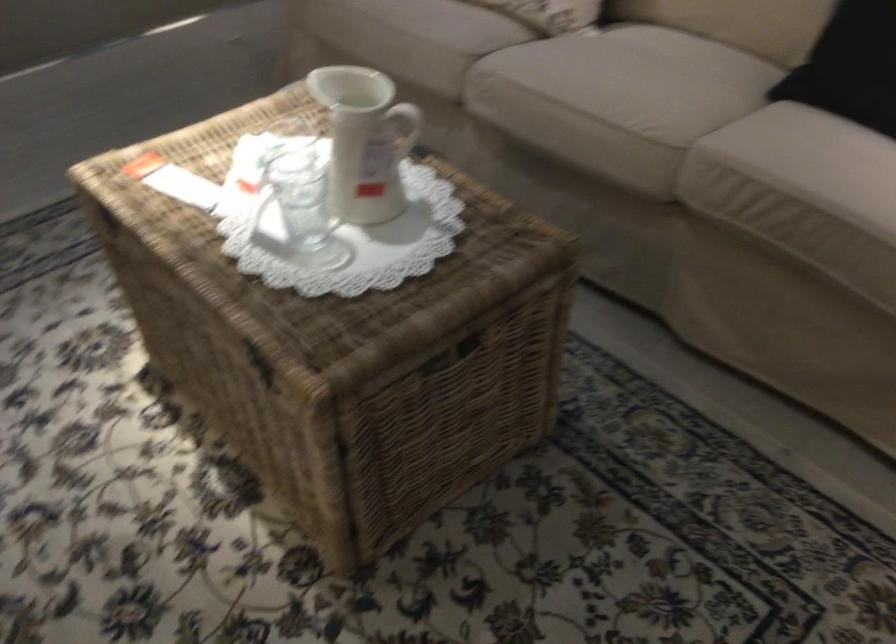
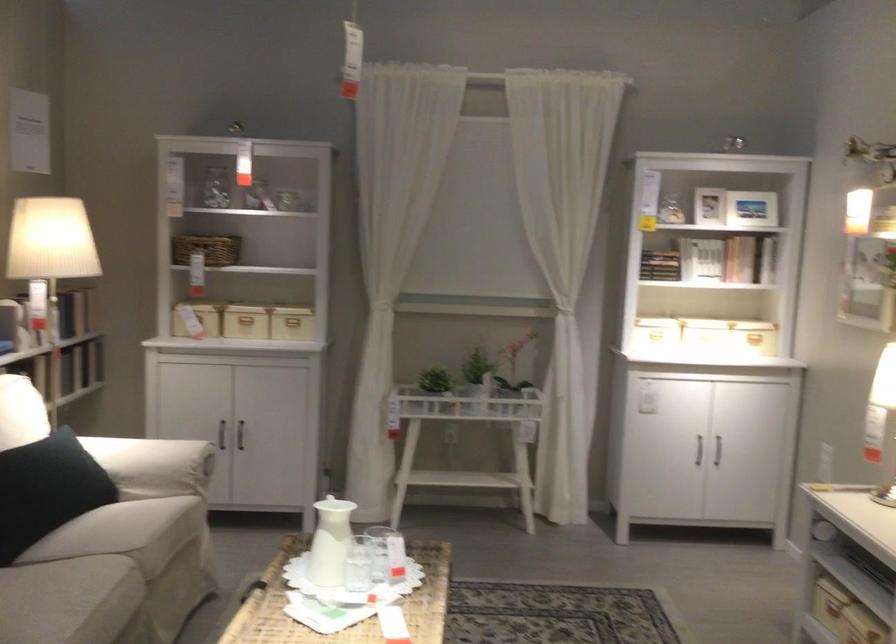
Where in the second image is the point corresponding to (364,136) from the first image?

(330, 542)